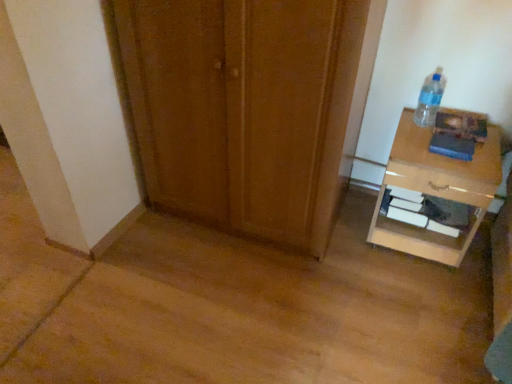
This screenshot has width=512, height=384. I want to click on free area in between light brown glossy nightstand at right and wooden door at center, so click(360, 244).